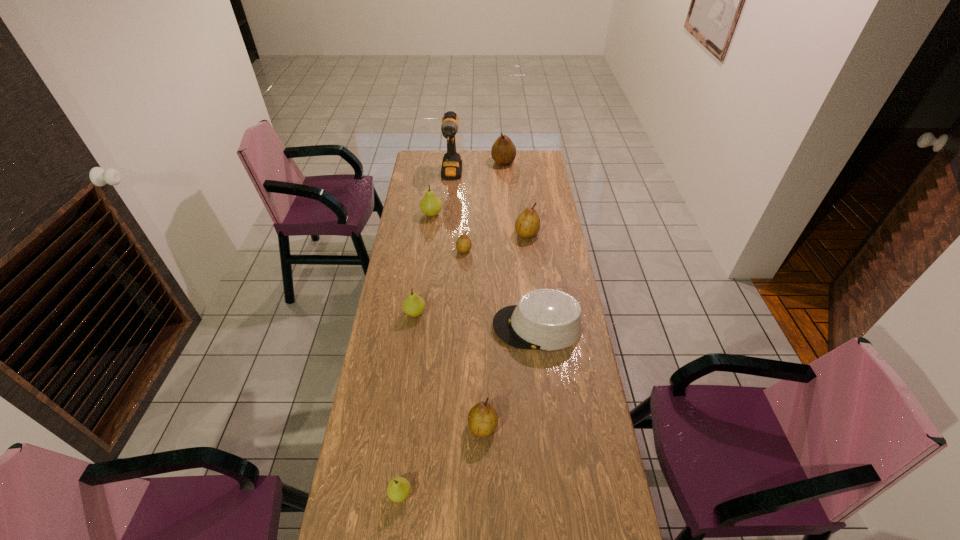
Locate an element on the screen. The width and height of the screenshot is (960, 540). the second nearest pear is located at coordinates pos(482,419).

Identify the location of hat. This screenshot has width=960, height=540. (545, 319).

At what (x,y) coordinates should I click in order to perform the action: click on the smallest brown pear. Please return your answer as a coordinate pair (x, y). Looking at the image, I should click on (463, 244).

What are the coordinates of `the fourth farthest pear` in the screenshot? It's located at (463, 244).

Find the location of a particular element. the nearest green pear is located at coordinates (399, 488).

Identify the location of the nearest pear. (399, 488).

Locate an element on the screen. This screenshot has height=540, width=960. vacant space located 0.100m with the drill bit of the tallest object facing forward is located at coordinates (449, 199).

In order to click on free space located 0.110m on the left of the second tallest object in this screenshot , I will do coord(472,162).

At what (x,y) coordinates should I click in order to perform the action: click on vacant position located on the back of the fifth nearest pear. Please return your answer as a coordinate pair (x, y). The height and width of the screenshot is (540, 960). Looking at the image, I should click on (522, 198).

At what (x,y) coordinates should I click in order to perform the action: click on free location located on the front of the biggest green pear. Please return your answer as a coordinate pair (x, y). The width and height of the screenshot is (960, 540). Looking at the image, I should click on [x=427, y=248].